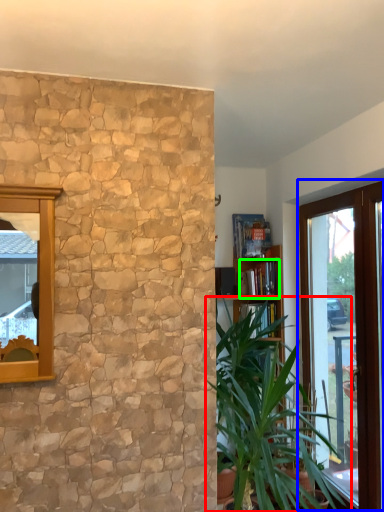
Question: Estimate the real-world distances between objects in this image. Which object is farther from houseplant (highlighted by a red box), window (highlighted by a blue box) or book (highlighted by a green box)?

Choices:
 (A) window
 (B) book

Answer: (B)